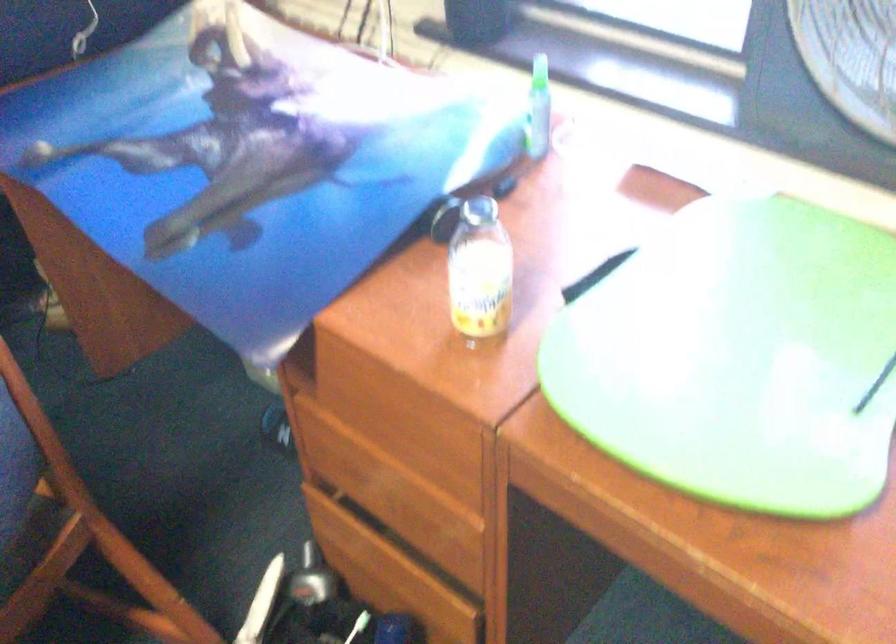
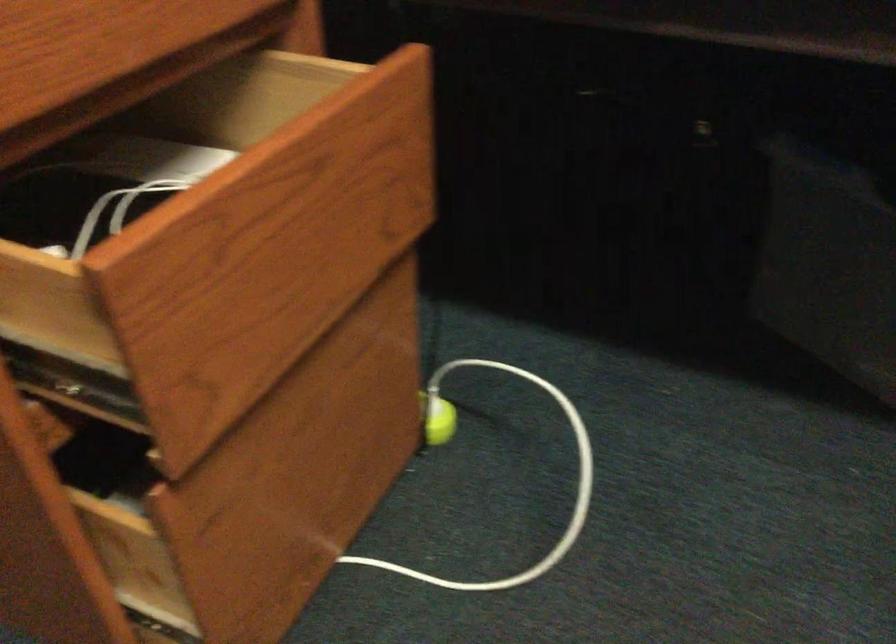
First-person continuous shooting, in which direction is the camera rotating?

The camera rotated toward right-down.